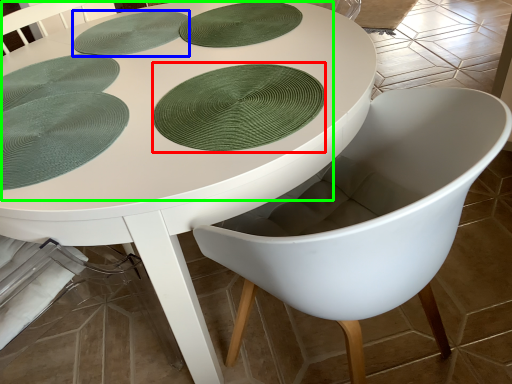
Question: Which object is the farthest from paper plate (highlighted by a red box)? Choose among these: platter (highlighted by a blue box) or poker table (highlighted by a green box).

Choices:
 (A) platter
 (B) poker table

Answer: (A)